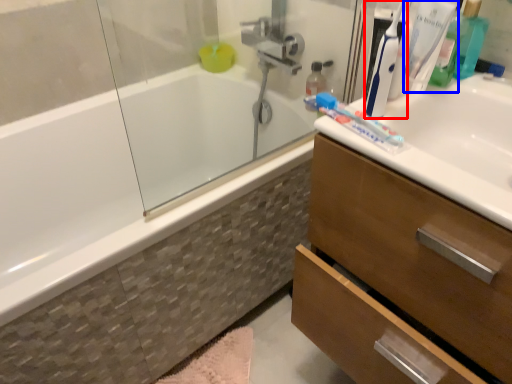
Question: Which point is further to the camera, toothbrush (highlighted by a red box) or toothbrush (highlighted by a blue box)?

Choices:
 (A) toothbrush
 (B) toothbrush

Answer: (B)